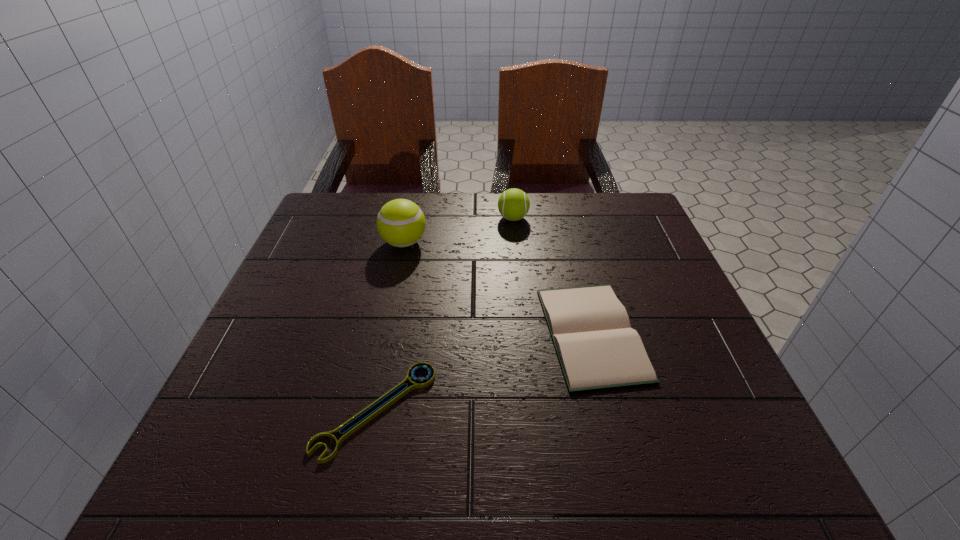
What are the coordinates of `the left tennis ball` in the screenshot? It's located at (401, 223).

The image size is (960, 540). I want to click on the third nearest object, so click(401, 223).

This screenshot has height=540, width=960. What are the coordinates of `the farthest object` in the screenshot? It's located at (513, 204).

You are a GUI agent. You are given a task and a screenshot of the screen. Output one action in this format:
    pyautogui.click(x=<x>, y=<y>)
    Task: Click on the shorter tennis ball
    The height and width of the screenshot is (540, 960).
    Given the screenshot: What is the action you would take?
    coord(513,204)

At what (x,y) coordinates should I click in order to perform the action: click on hardback book. Please return your answer as a coordinate pair (x, y). This screenshot has height=540, width=960. Looking at the image, I should click on (597, 348).

At what (x,y) coordinates should I click in order to perform the action: click on wrench. Please return your answer as a coordinate pair (x, y). The height and width of the screenshot is (540, 960). Looking at the image, I should click on (x=419, y=383).

Identify the location of free spot located on the right of the third nearest object. (526, 242).

Locate an element on the screen. The image size is (960, 540). vacant space situated 0.220m on the left of the farther tennis ball is located at coordinates (417, 218).

Where is `vacant space located 0.100m on the back of the hardback book`? vacant space located 0.100m on the back of the hardback book is located at coordinates (573, 259).

Find the location of a particular element. The width and height of the screenshot is (960, 540). free region located on the back of the wrench is located at coordinates (391, 337).